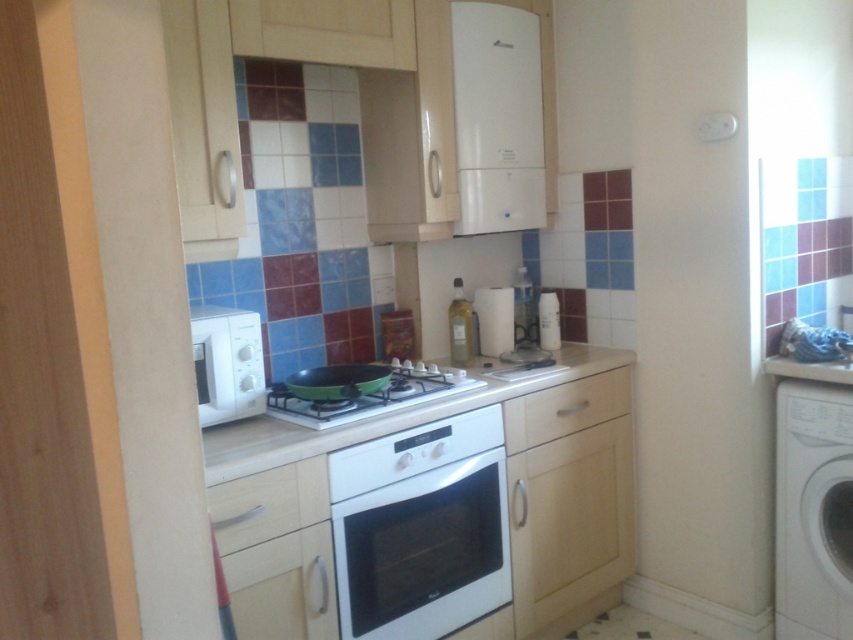
Question: Is white glossy countertop at center smaller than white glossy gas stove at center?

Choices:
 (A) yes
 (B) no

Answer: (B)

Question: Which point appears closest to the camera in this image?

Choices:
 (A) (624, 353)
 (B) (225, 356)

Answer: (B)

Question: Which point is closer to the camera taking this photo?

Choices:
 (A) (474, 392)
 (B) (264, 394)
 (C) (503, 36)

Answer: (B)

Question: Can you confirm if white glossy oven at center is positioned to the right of white glossy gas stove at center?

Choices:
 (A) yes
 (B) no

Answer: (A)

Question: Does white matte microwave at left lie in front of white glossy gas stove at center?

Choices:
 (A) yes
 (B) no

Answer: (A)

Question: Which of the following is the closest to the observer?

Choices:
 (A) (494, 90)
 (B) (505, 552)

Answer: (B)